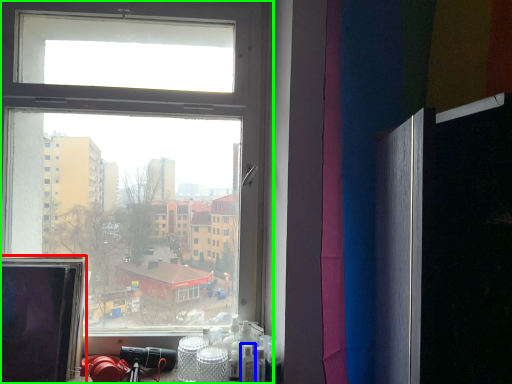
Question: Based on their relative distances, which object is nearer to computer screen (highlighted by a red box)? Choose from toiletry (highlighted by a blue box) and window (highlighted by a green box).

Choices:
 (A) toiletry
 (B) window

Answer: (B)